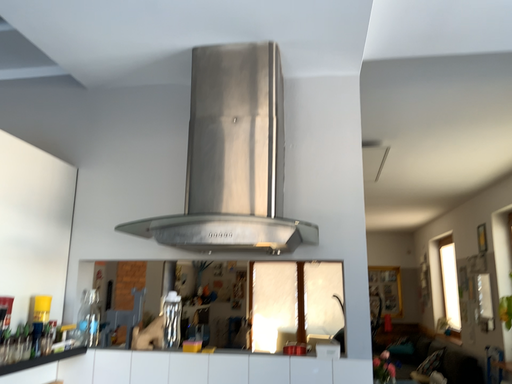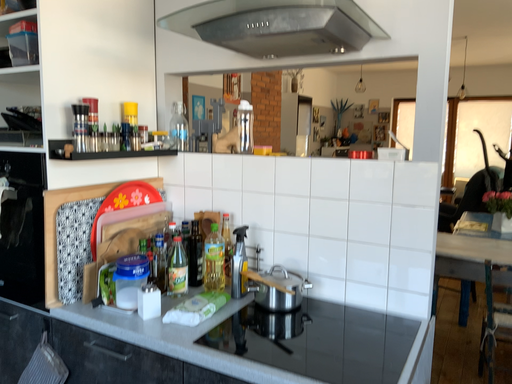
Question: Which way did the camera rotate in the video?

Choices:
 (A) rotated left
 (B) rotated right

Answer: (A)